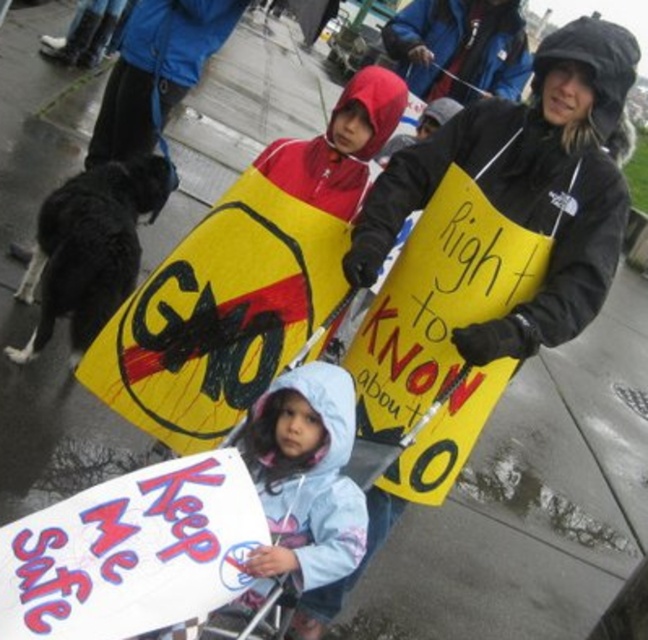
Can you confirm if yellow paper sign at center is positioned to the right of light blue fabric jacket at center?

Correct, you'll find yellow paper sign at center to the right of light blue fabric jacket at center.

Who is taller, yellow paper sign at center or light blue fabric jacket at center?

Standing taller between the two is yellow paper sign at center.

Measure the distance between yellow paper sign at center and camera.

yellow paper sign at center and camera are 8.97 feet apart.

At what (x,y) coordinates should I click in order to perform the action: click on yellow paper sign at center. Please return your answer as a coordinate pair (x, y). This screenshot has height=640, width=648. Looking at the image, I should click on (527, 186).

Is light blue fabric jacket at center to the left of blue hooded jacket at upper center from the viewer's perspective?

Correct, you'll find light blue fabric jacket at center to the left of blue hooded jacket at upper center.

Does light blue fabric jacket at center have a lesser height compared to blue hooded jacket at upper center?

Incorrect, light blue fabric jacket at center's height does not fall short of blue hooded jacket at upper center's.

Identify the location of light blue fabric jacket at center. (305, 477).

Between yellow paper sign at center and blue hooded jacket at upper center, which one has less height?

Standing shorter between the two is blue hooded jacket at upper center.

Does yellow paper sign at center appear over blue hooded jacket at upper center?

Actually, yellow paper sign at center is below blue hooded jacket at upper center.

Describe the element at coordinates (527, 186) in the screenshot. I see `yellow paper sign at center` at that location.

The image size is (648, 640). Find the location of `yellow paper sign at center`. yellow paper sign at center is located at coordinates (527, 186).